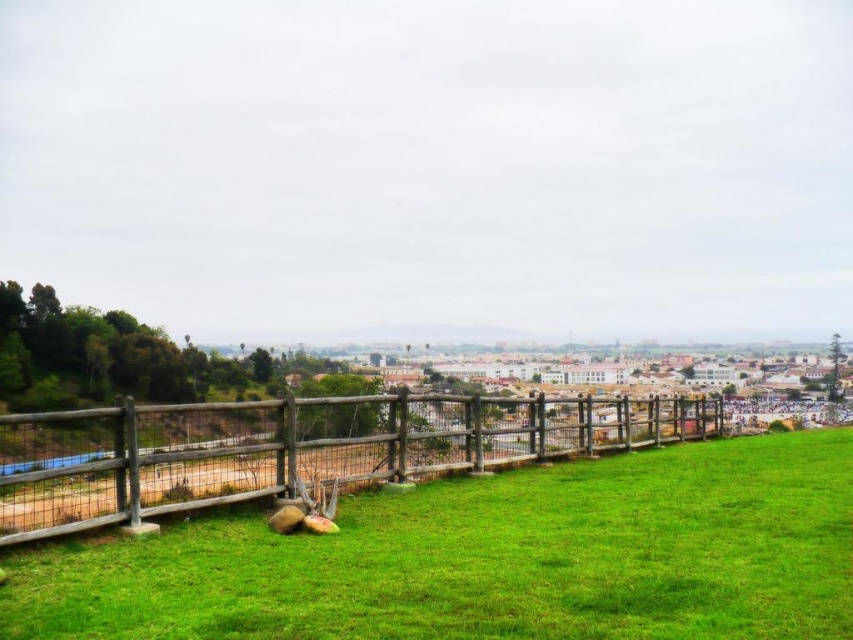
You are standing at the edge of the green grassy at center and want to walk towards the brown wooden fence at lower left. Which direction should you move to reach the fence?

To reach the brown wooden fence at lower left from the green grassy at center, you should move downward since the green grassy at center is located above the brown wooden fence at lower left.

You are standing in the landscape scene and want to walk towards the green grassy area at center. Which object, the green grassy at center or the brown wooden fence at lower left, will you encounter first?

The green grassy at center is closer to the viewer than the brown wooden fence at lower left, so you will encounter the green grassy at center first.